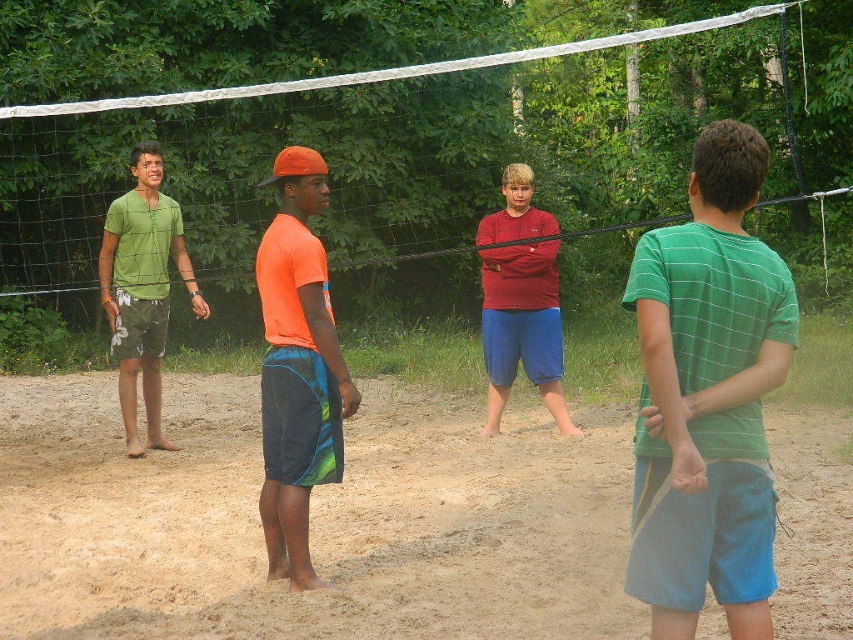
Which of these two, green matte shorts at left or matte red shirt at center, stands taller?

With more height is green matte shorts at left.

What do you see at coordinates (142, 289) in the screenshot? I see `green matte shorts at left` at bounding box center [142, 289].

Is point (167, 196) closer to viewer compared to point (512, 179)?

That is True.

At what (x,y) coordinates should I click in order to perform the action: click on green matte shorts at left. Please return your answer as a coordinate pair (x, y). Image resolution: width=853 pixels, height=640 pixels. Looking at the image, I should click on (142, 289).

Is white mesh net at center below orange matte t-shirt at center?

No, white mesh net at center is not below orange matte t-shirt at center.

This screenshot has height=640, width=853. What do you see at coordinates (430, 145) in the screenshot?
I see `white mesh net at center` at bounding box center [430, 145].

Which is in front, point (563, 145) or point (289, 440)?

Point (289, 440)

Find the location of a particular element. white mesh net at center is located at coordinates (430, 145).

In the scene shown: Which is below, orange matte t-shirt at center or green matte shorts at left?

orange matte t-shirt at center is below.

Which is in front, point (340, 444) or point (160, 400)?

Point (340, 444) is in front.

Locate an element on the screen. The width and height of the screenshot is (853, 640). orange matte t-shirt at center is located at coordinates (297, 368).